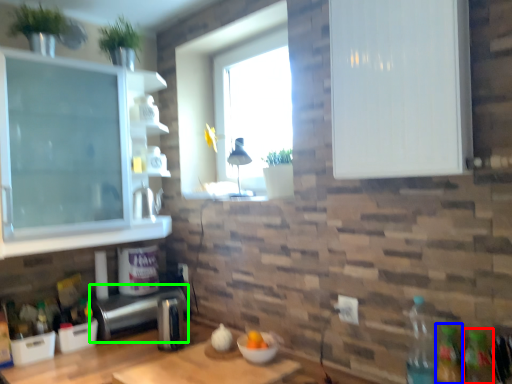
Question: Which is nearer to the bottle (highlighted by a red box)? bottle (highlighted by a blue box) or appliance (highlighted by a green box).

Choices:
 (A) bottle
 (B) appliance

Answer: (A)